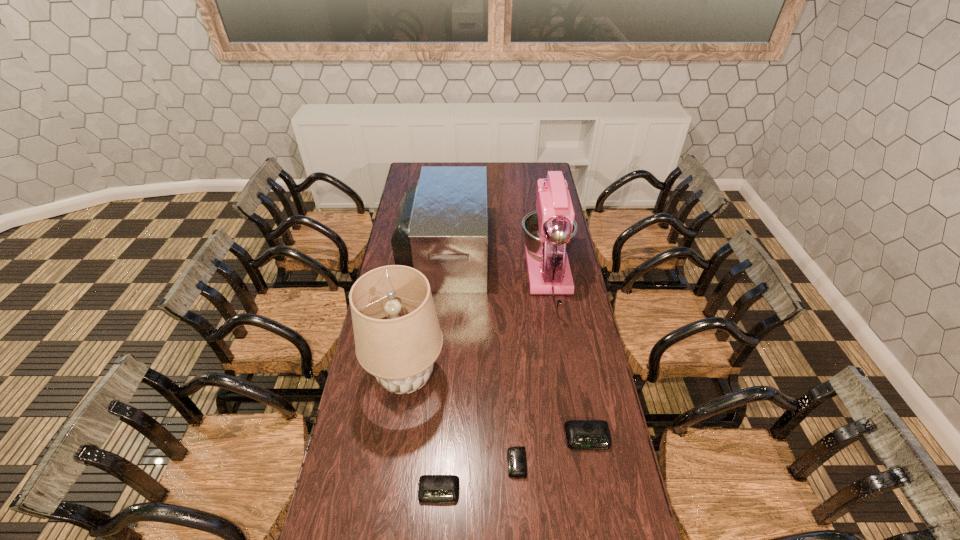
Where is `vacant spot to place a alarm clock on the left`? Image resolution: width=960 pixels, height=540 pixels. vacant spot to place a alarm clock on the left is located at coordinates (354, 522).